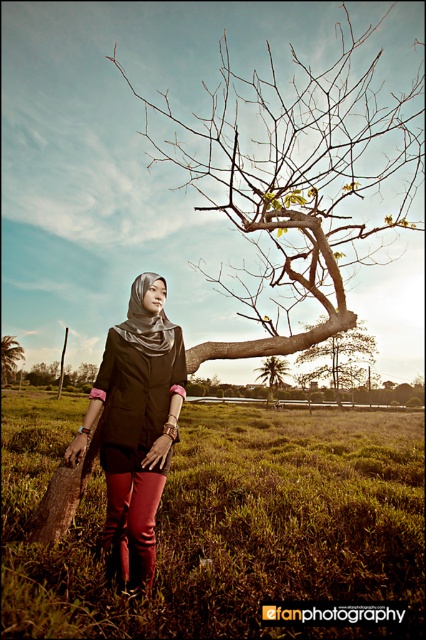
Does brown textured tree at center have a larger size compared to green leafy tree at center?

Yes.

Does brown textured tree at center appear on the left side of green leafy tree at center?

Indeed, brown textured tree at center is positioned on the left side of green leafy tree at center.

Who is more distant from viewer, (206, 147) or (284, 368)?

The point (284, 368) is more distant.

The image size is (426, 640). Identify the location of brown textured tree at center. (296, 182).

Which of these two, matte black hijab at center or green leafy tree at center, stands shorter?

With less height is matte black hijab at center.

Locate an element on the screen. matte black hijab at center is located at coordinates (135, 426).

Is point (42, 419) less distant than point (3, 364)?

Yes.

Can you confirm if matte brown pants at center is shorter than brown wood tree at left?

Indeed, matte brown pants at center has a lesser height compared to brown wood tree at left.

Who is more distant from viewer, (397, 547) or (8, 337)?

Positioned behind is point (8, 337).

The width and height of the screenshot is (426, 640). What are the coordinates of `matte brown pants at center` in the screenshot? It's located at (221, 520).